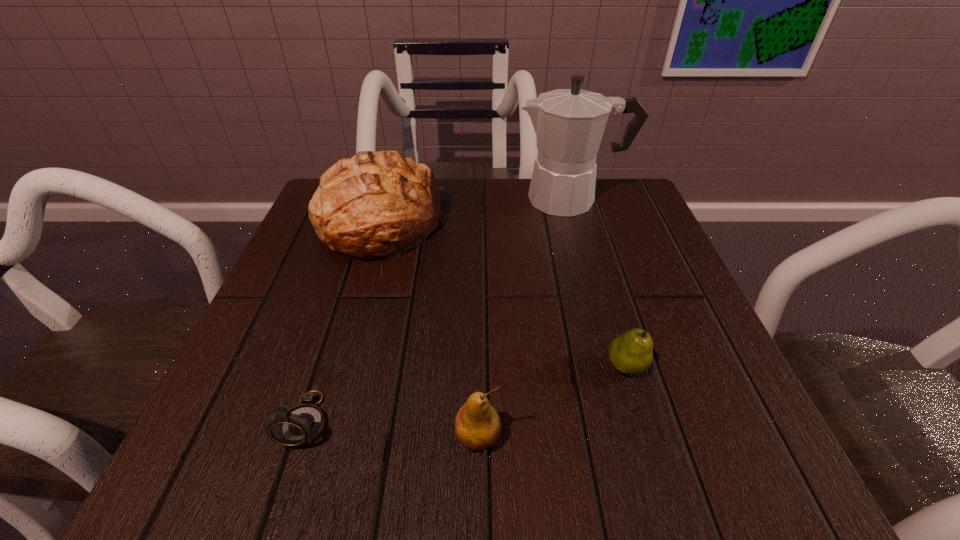
Find the location of a particular element. The height and width of the screenshot is (540, 960). coffeepot is located at coordinates (569, 124).

Find the location of `the fourth shortest object`. the fourth shortest object is located at coordinates (375, 205).

Locate an element on the screen. The image size is (960, 540). the third shortest object is located at coordinates (477, 424).

Identify the location of the third object from left to right. (477, 424).

Find the location of a particular element. The width and height of the screenshot is (960, 540). the farther pear is located at coordinates (631, 353).

Where is `the third farthest object`? the third farthest object is located at coordinates (631, 353).

Identify the location of compass. This screenshot has height=540, width=960. (302, 424).

At what (x,y) coordinates should I click in order to perform the action: click on vacant point located at the spout of the tallest object. Please return your answer as a coordinate pair (x, y). This screenshot has width=960, height=540. Looking at the image, I should click on (385, 199).

Locate an element on the screen. vacant space located at the spout of the tallest object is located at coordinates (342, 199).

Identify the location of blank area located at the spout of the tallest object. The image size is (960, 540). (407, 199).